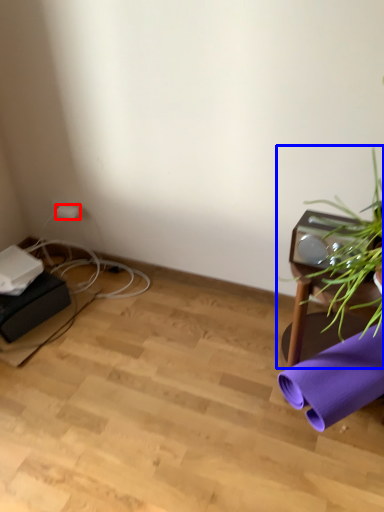
Question: Which object appears farthest to the camera in this image, plug (highlighted by a red box) or houseplant (highlighted by a blue box)?

Choices:
 (A) plug
 (B) houseplant

Answer: (A)